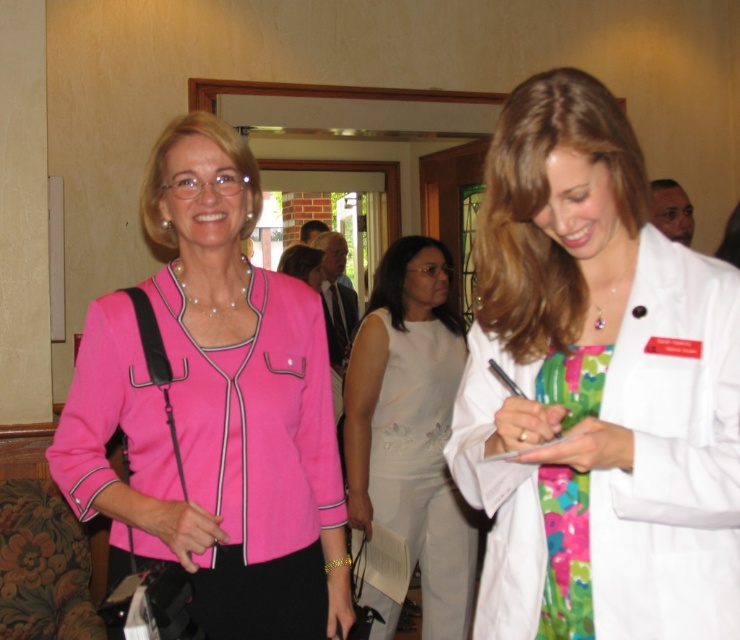
You are attending a formal event and need to decide whether to wear the white matte lab coat at right or the white satin dress at center. Based on their positions in the image, which one is more elevated in status?

The white matte lab coat at right is located above the white satin dress at center, indicating it holds a higher position and possibly greater status in the image.

You are attending a professional event and need to decide whether to wear your white matte lab coat at right over your pink fabric jacket at center. Based on the image, is this arrangement possible?

The white matte lab coat at right is positioned over the pink fabric jacket at center in the image, so yes, this arrangement is possible.

You are organizing a photoshoot and need to decide which garment to use for a closeup shot. The camera frame can only accommodate items up to the width of the white satin dress at center. Will the white matte lab coat at right fit within the frame?

The white matte lab coat at right is thinner than the white satin dress at center, so it will fit within the camera frame designed for the width of the white satin dress at center.